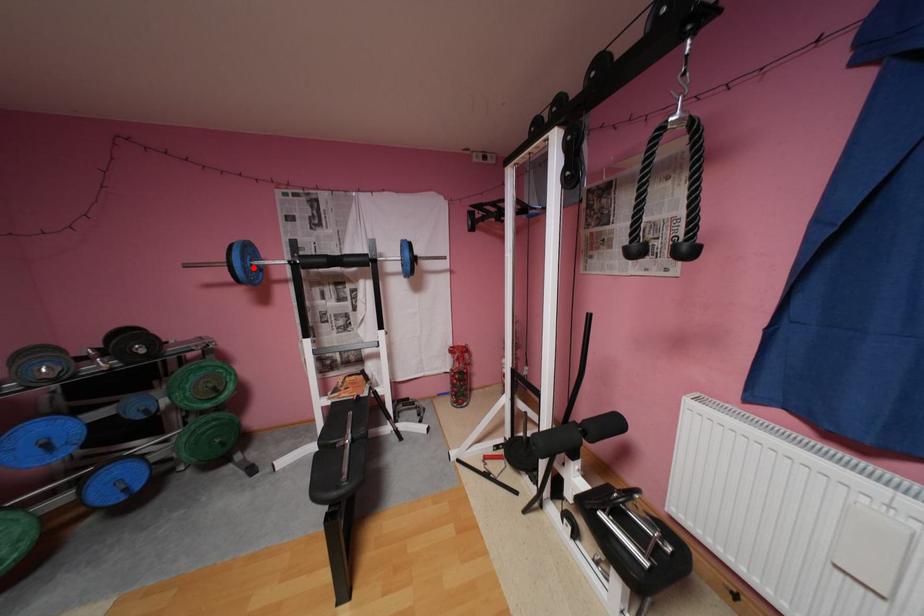
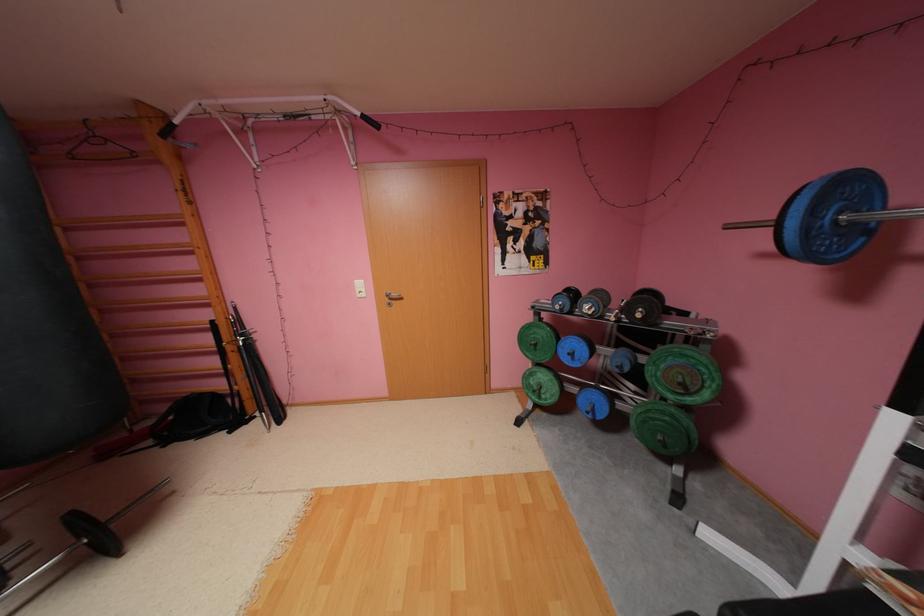
Where in the second image is the point corresponding to the highlighted location from the first image?

(816, 229)